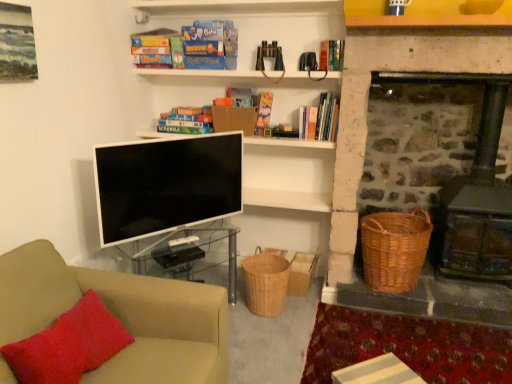
What are the coordinates of `vacant region under matte cardboard book at upper center, which is the fourth book in right-to-left order (from a real-world perspective)` in the screenshot? It's located at (182, 122).